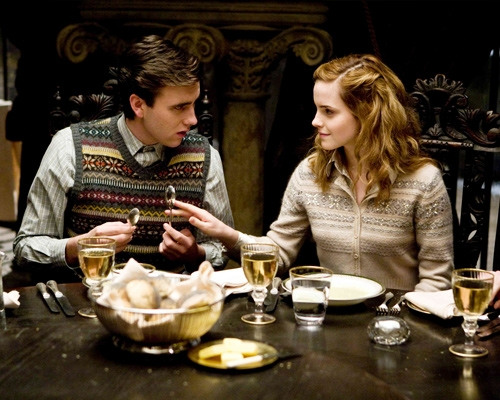
Locate an element on the screen. The image size is (500, 400). dark brown table surface is located at coordinates (324, 371), (93, 370).